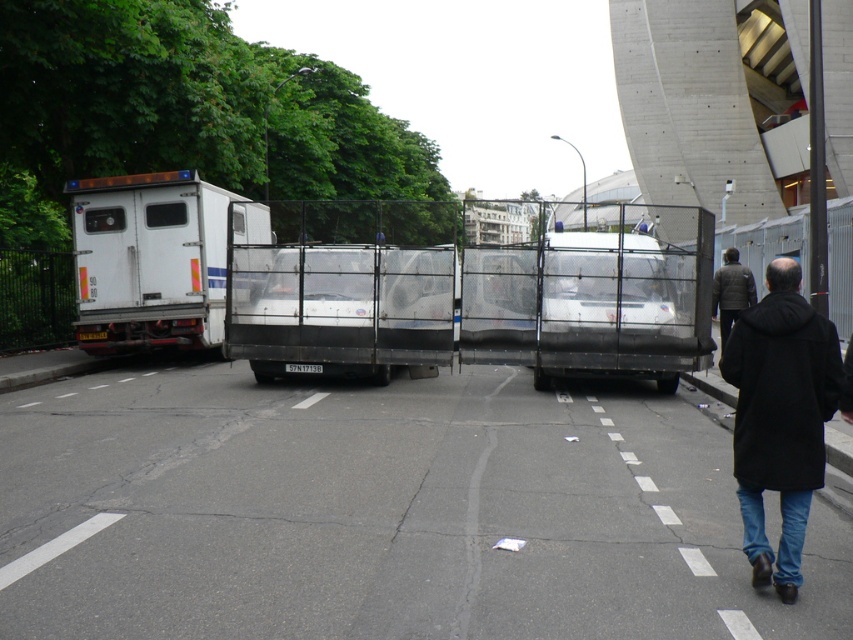
Is point (741, 452) farther from viewer compared to point (723, 284)?

That is False.

Which is more to the left, black matte coat at lower right or brown textured jacket at center right?

From the viewer's perspective, black matte coat at lower right appears more on the left side.

In the scene shown: Who is more forward, (837, 346) or (730, 268)?

Positioned in front is point (837, 346).

Find the location of a particular element. The height and width of the screenshot is (640, 853). black matte coat at lower right is located at coordinates (780, 417).

Is point (256, 227) in front of point (747, 317)?

No.

Can you confirm if white matte truck at left is taller than black matte coat at lower right?

Yes, white matte truck at left is taller than black matte coat at lower right.

Who is more distant from viewer, (x=251, y=214) or (x=776, y=289)?

Point (x=251, y=214)

Find the location of `white matte truck at left`. white matte truck at left is located at coordinates (154, 259).

Can you confirm if white matte truck at left is positioned to the left of brown textured jacket at center right?

Yes, white matte truck at left is to the left of brown textured jacket at center right.

Is the position of white matte truck at left less distant than that of brown textured jacket at center right?

No, it is behind brown textured jacket at center right.

Where is `white matte truck at left`? white matte truck at left is located at coordinates (154, 259).